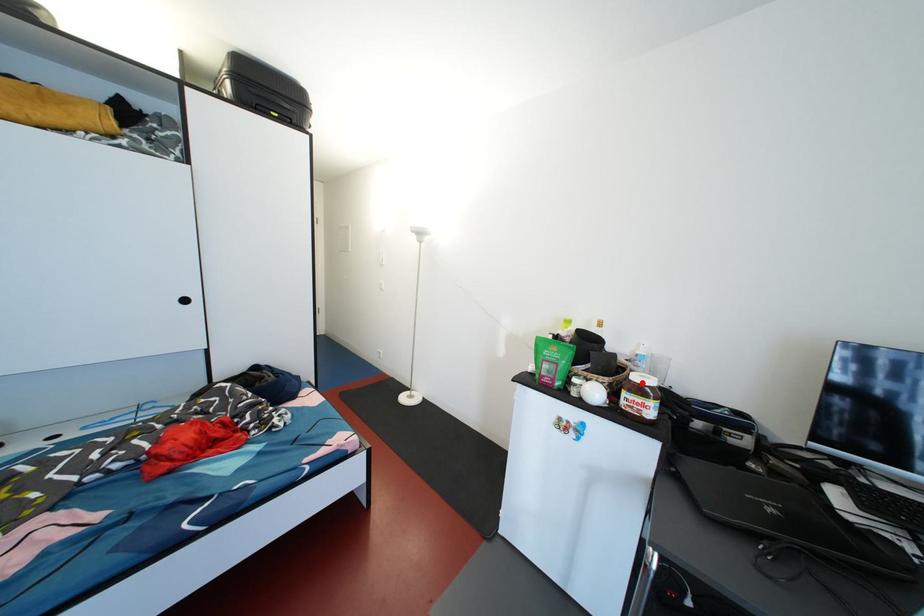
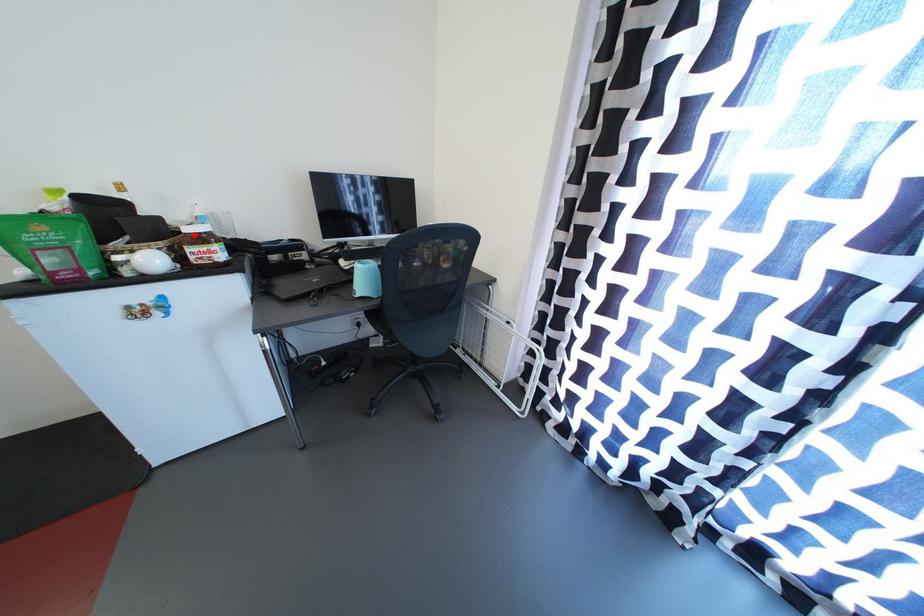
I am providing you with two images of the same scene from different viewpoints. A red point is marked on the first image and another point is marked on the second image. Is the red point in image1 aligned with the point shown in image2?

Yes